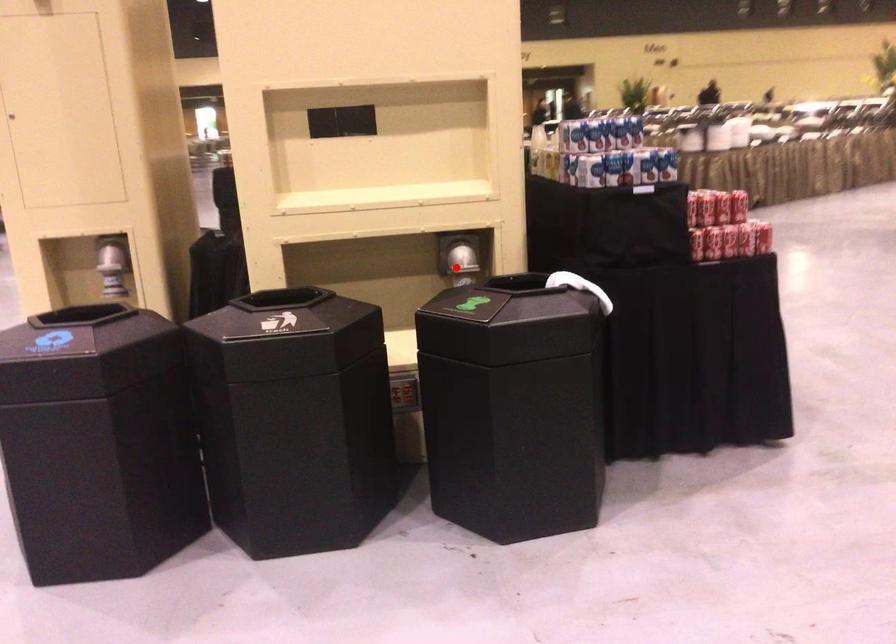
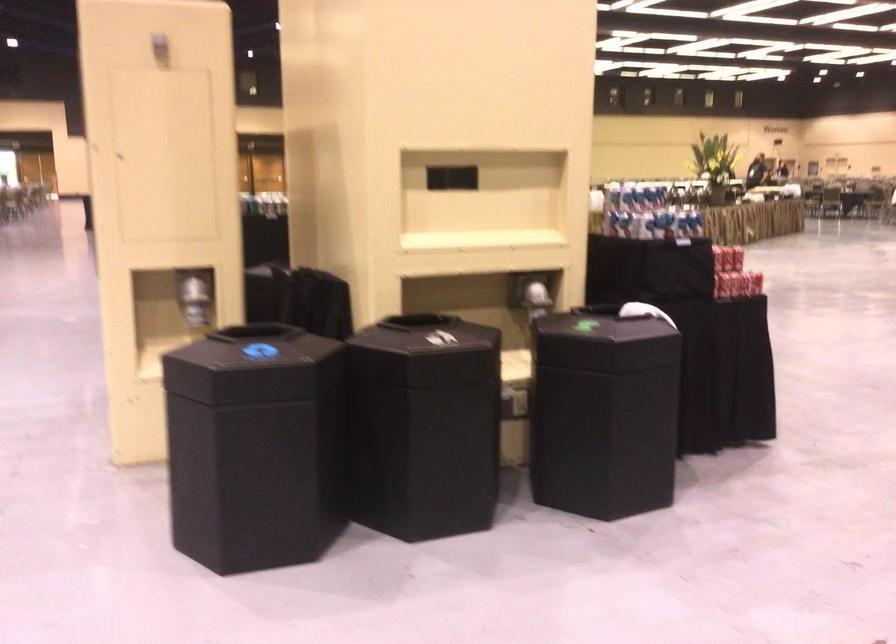
Locate, in the second image, the point that corresponds to the highlighted location in the first image.

(536, 299)